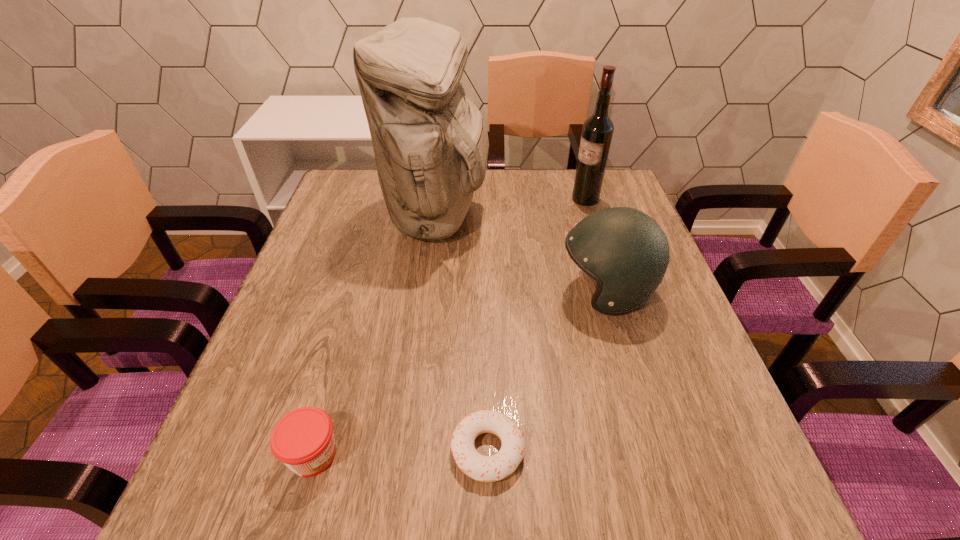
The image size is (960, 540). I want to click on free space between the wine bottle and the doughnut, so click(537, 325).

The height and width of the screenshot is (540, 960). Find the location of `empty location between the second tallest object and the doughnut`. empty location between the second tallest object and the doughnut is located at coordinates (537, 325).

This screenshot has height=540, width=960. Identify the location of vacant point located between the third shortest object and the jam. (459, 373).

Image resolution: width=960 pixels, height=540 pixels. Identify the location of empty space between the third tallest object and the backpack. (521, 253).

This screenshot has width=960, height=540. Identify the location of blank region between the second shortest object and the shortest object. (400, 452).

Locate an element on the screen. This screenshot has width=960, height=540. object that is the fourth closest to the second tallest object is located at coordinates (303, 439).

Identify which object is located as the second nearest to the shortest object. Please provide its 2D coordinates. Your answer should be formatted as a tuple, i.e. [(x, y)], where the tuple contains the x and y coordinates of a point satisfying the conditions above.

[(626, 252)]

I want to click on vacant point that satisfies the following two spatial constraints: 1. on the back side of the doughnut; 2. on the front-facing side of the tallest object, so click(x=485, y=215).